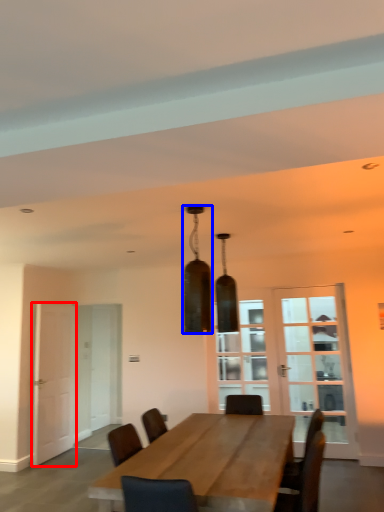
Question: Which point is closer to the camera, door (highlighted by a red box) or lamp (highlighted by a blue box)?

Choices:
 (A) door
 (B) lamp

Answer: (B)